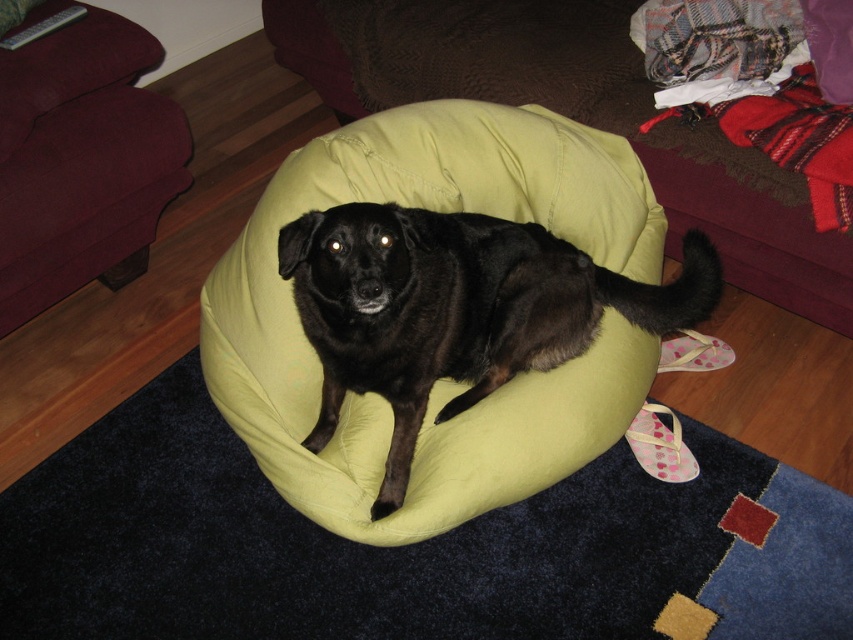
Question: Which point is closer to the camera taking this photo?

Choices:
 (A) (683, 282)
 (B) (27, 86)
 (C) (363, 88)

Answer: (A)

Question: Among these objects, which one is nearest to the camera?

Choices:
 (A) black matte dog at center
 (B) maroon fabric couch at upper left

Answer: (A)

Question: Estimate the real-world distances between objects in this image. Which object is farther from the maroon fabric couch at upper left?

Choices:
 (A) black matte dog at center
 (B) green fabric couch at center

Answer: (A)

Question: Does black matte dog at center have a greater width compared to maroon fabric couch at upper left?

Choices:
 (A) no
 (B) yes

Answer: (B)

Question: Is black matte dog at center smaller than maroon fabric couch at upper left?

Choices:
 (A) no
 (B) yes

Answer: (A)

Question: Does green fabric couch at center appear on the left side of black matte dog at center?

Choices:
 (A) no
 (B) yes

Answer: (A)